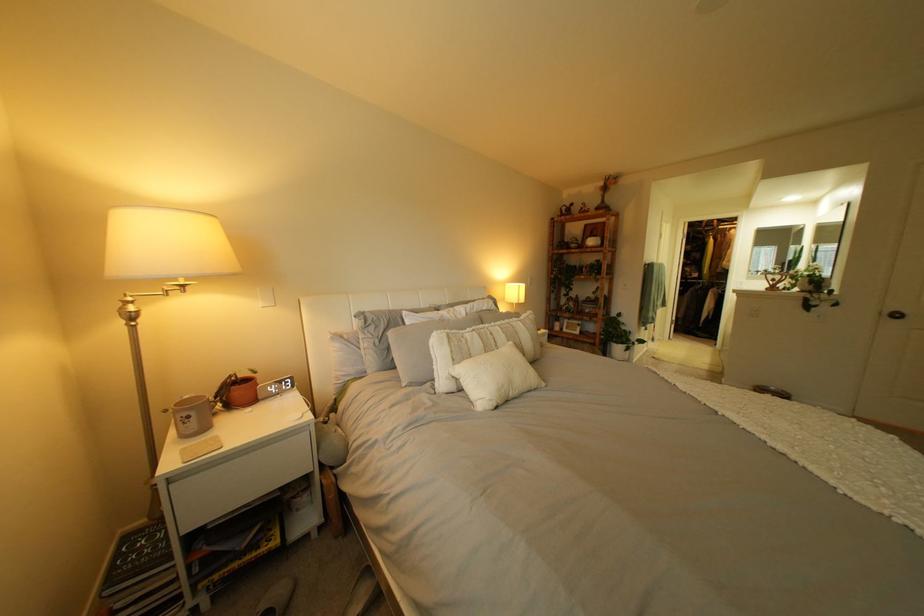
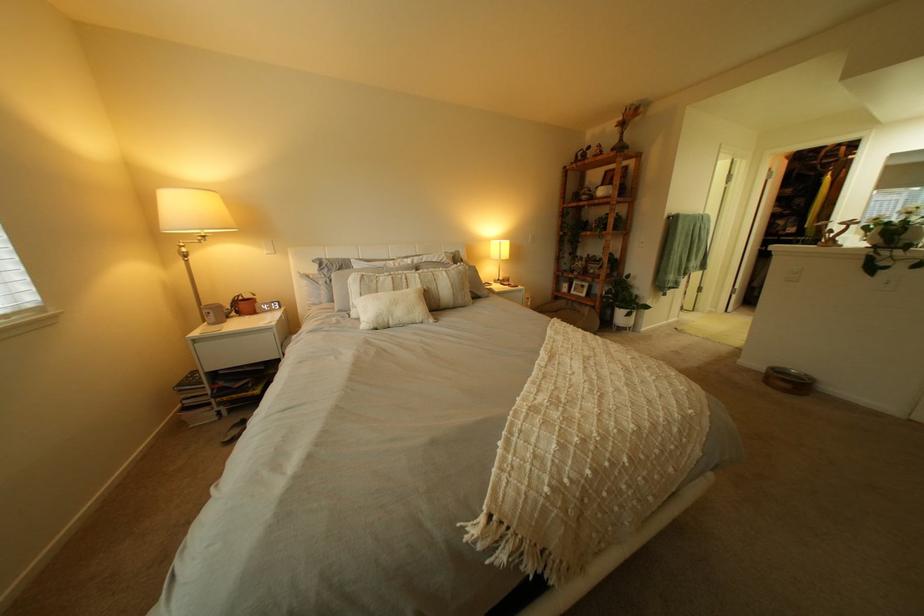
Where in the second image is the point corresponding to point (188, 480) from the first image?

(211, 342)